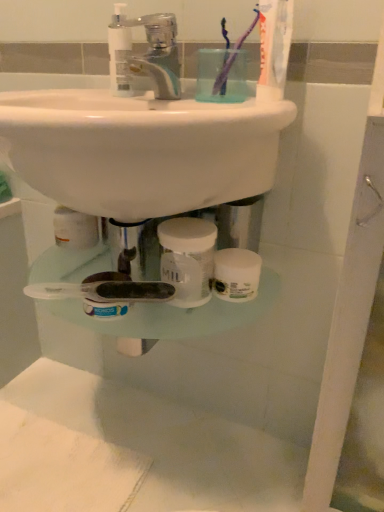
I want to click on vacant area that lies between transparent plastic mouthwash at upper center, which is the 1th mouthwash in left-to-right order, and purple plastic toothbrush at upper center, placed as the 1th toothbrush when sorted from left to right, so click(x=163, y=95).